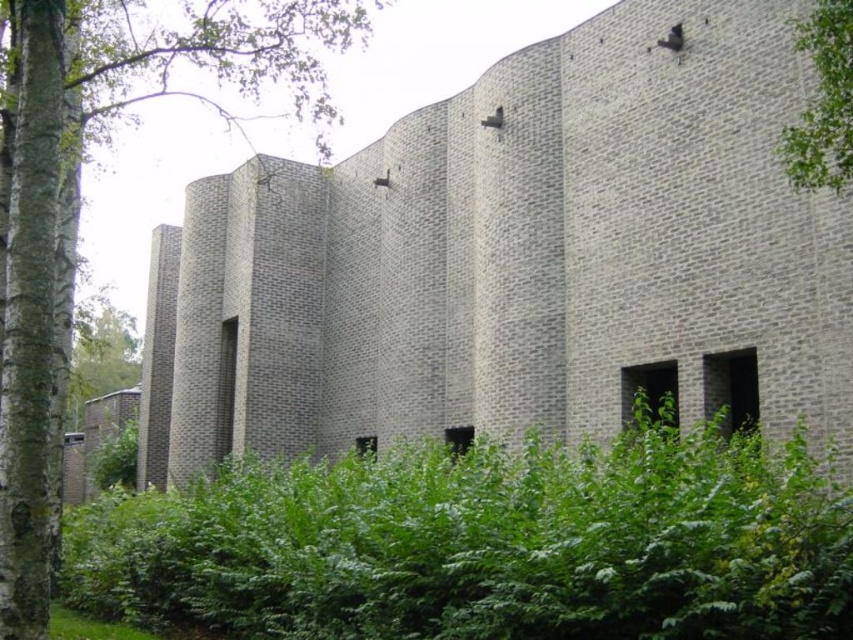
You are standing in front of the modern architectural structure and notice the green leafy tree at left. Can you determine its exact position relative to the building?

The green leafy tree at left is located at point (78, 200), which places it on the left side of the building.

Looking at this image, you are standing at the point labeled point (x=816, y=156). If you walk 100 feet directly towards the viewer, will you still be within the scene?

The point labeled point (x=816, y=156) is 115.10 feet away from the viewer. If you walk 100 feet towards the viewer, you will still be 15.10 feet away from the viewer and within the scene.

You are standing in front of the modern brick building and want to take a photo that includes both the green leafy tree at upper right and the green leafy grass at lower left. Which object should you position closer to the top of your camera frame?

You should position the green leafy tree at upper right closer to the top of your camera frame since it is located above the green leafy grass at lower left in the scene.